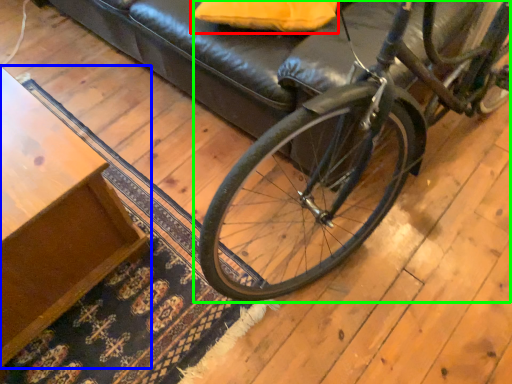
Question: Which object is positioned farthest from pillow (highlighted by a red box)? Select from table (highlighted by a blue box) and bicycle (highlighted by a green box).

Choices:
 (A) table
 (B) bicycle

Answer: (A)